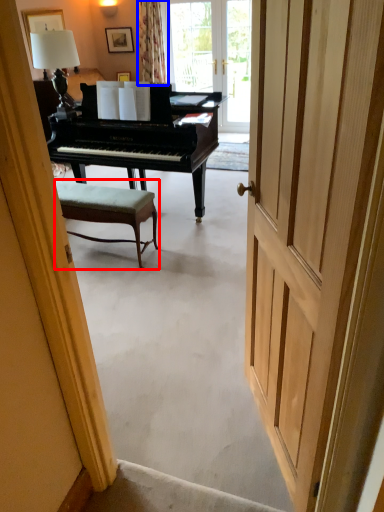
Question: Which object is further to the camera taking this photo, chair (highlighted by a red box) or curtain (highlighted by a blue box)?

Choices:
 (A) chair
 (B) curtain

Answer: (B)